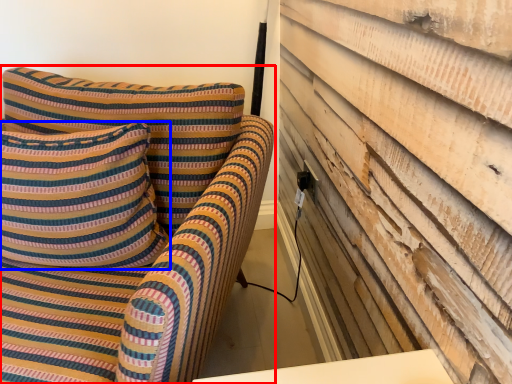
Question: Which object appears farthest to the camera in this image, furniture (highlighted by a red box) or pillow (highlighted by a blue box)?

Choices:
 (A) furniture
 (B) pillow

Answer: (B)